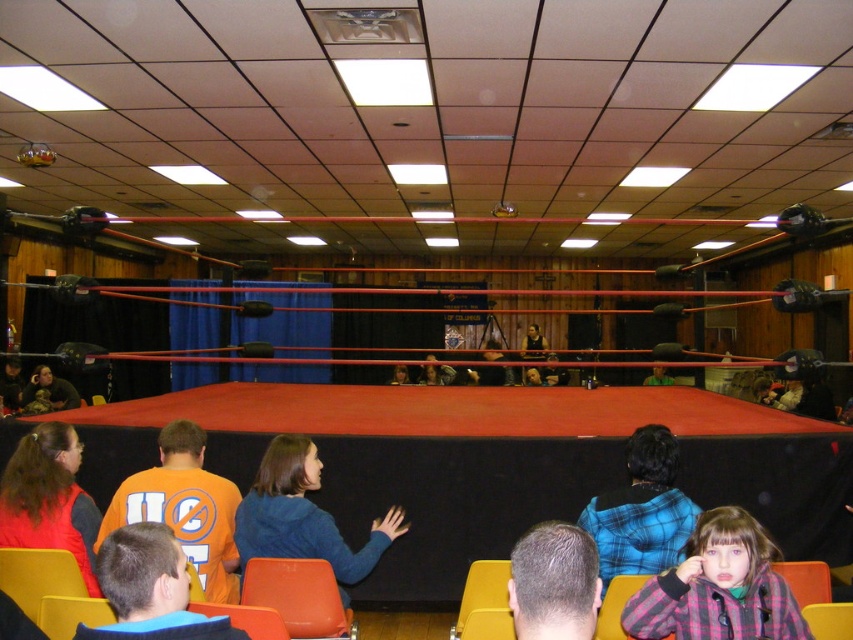
You are a photographer setting up for a wrestling match. You need to position a camera to capture both the plaid flannel shirt at lower right and the orange plastic chair at lower center without moving the camera. Which object should be placed closer to the camera to ensure both are in frame?

The plaid flannel shirt at lower right is to the right of the orange plastic chair at lower center. To ensure both are in frame, the orange plastic chair at lower center should be closer to the camera since it is positioned to the left of the plaid flannel shirt at lower right.

You are a wrestler preparing for a match and need to sit on the orange plastic chair at lower center. However, you notice the matte black jacket at lower left nearby. Which object is shorter in height between the two?

The orange plastic chair at lower center has a lesser height compared to the matte black jacket at lower left, so the orange plastic chair at lower center is shorter in height.

You are standing in the wrestling ring and looking towards the blue curtain. Where is the plaid flannel shirt at lower right located relative to your position?

The plaid flannel shirt at lower right is located at the lower right corner of the image, positioned at coordinates approximately 0.919 on the x axis and 0.843 on the y axis.